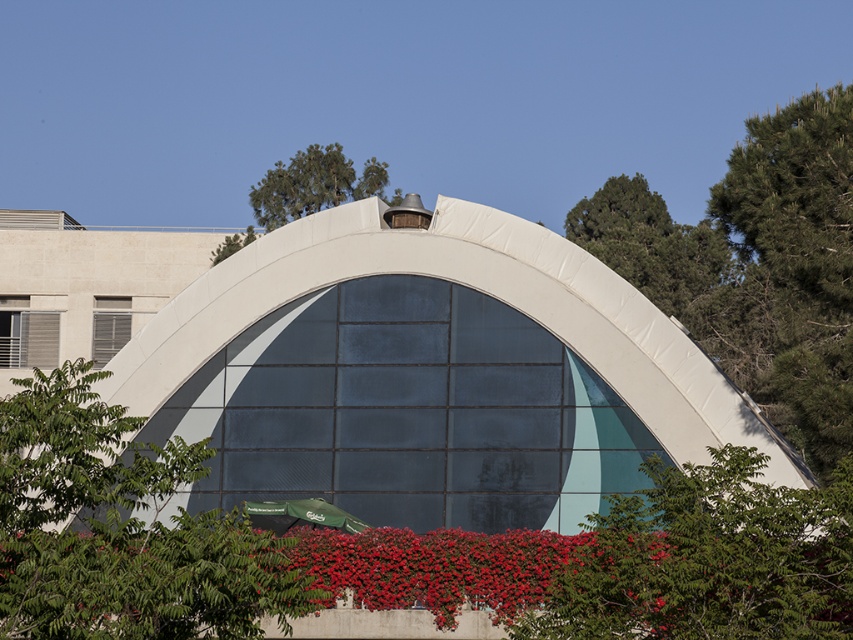
You are standing at the point marked by the coordinates point (120, 529). Looking towards the building, which direction should you turn to face the red flowers planted along the base of the building?

The point (120, 529) marks the green leafy tree at lower left. To face the red flowers planted along the base of the building, you should turn to your right since the red flowers are located in front of the building, which is opposite the direction of the green leafy tree at lower left.

You are standing at the entrance of the building and want to find the green leafy tree at lower left. According to the coordinates provided, where should you look relative to your current position?

The green leafy tree at lower left is located at coordinates point [120,529], which means it is positioned to the lower left side from your current position at the entrance.